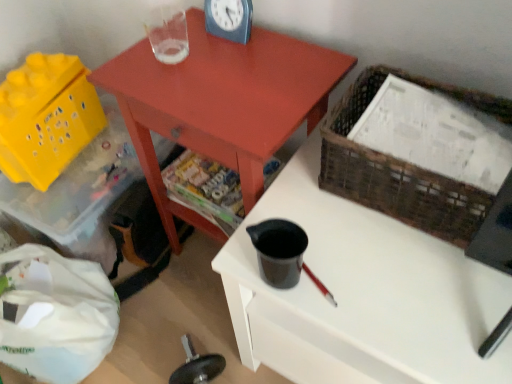
Locate an element on the screen. This screenshot has height=384, width=512. vacant area that is in front of blue plastic clock at upper center is located at coordinates (228, 72).